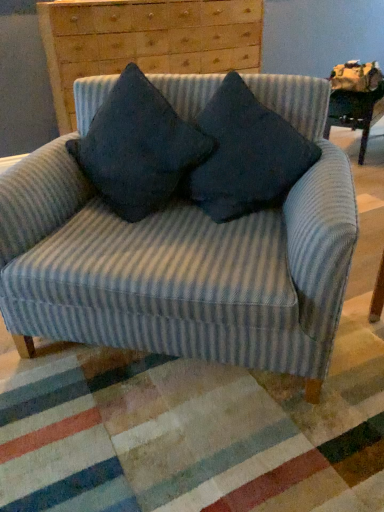
Question: Considering the positions of dark blue fabric pillow at center, which is counted as the first pillow, starting from the left, and wooden chest of drawers at upper center in the image, is dark blue fabric pillow at center, which is counted as the first pillow, starting from the left, wider or thinner than wooden chest of drawers at upper center?

Choices:
 (A) wide
 (B) thin

Answer: (B)

Question: Based on their positions, is dark blue fabric pillow at center, the 2th pillow viewed from the right, located to the left or right of wooden chest of drawers at upper center?

Choices:
 (A) left
 (B) right

Answer: (B)

Question: Considering the real-world distances, which object is farthest from the blue striped fabric chair at center?

Choices:
 (A) dark blue fabric pillow at center, which is the 1th pillow in right-to-left order
 (B) wooden chest of drawers at upper center
 (C) dark blue fabric pillow at center, the 2th pillow viewed from the right

Answer: (B)

Question: Which object is positioned closest to the blue striped fabric chair at center?

Choices:
 (A) wooden chest of drawers at upper center
 (B) dark blue fabric pillow at center, the 2th pillow viewed from the right
 (C) dark blue fabric pillow at center, which is the 1th pillow in right-to-left order

Answer: (B)